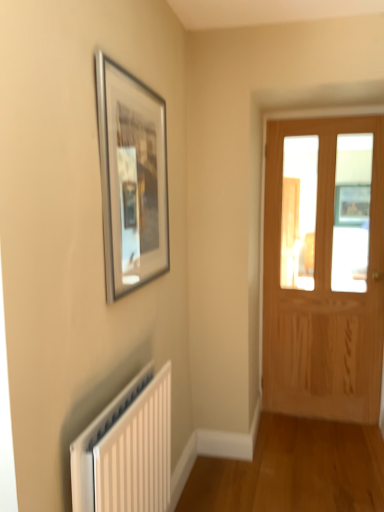
Question: Is white plastic radiator at lower left thinner than silver metallic picture frame at upper left?

Choices:
 (A) no
 (B) yes

Answer: (A)

Question: Is white plastic radiator at lower left behind silver metallic picture frame at upper left?

Choices:
 (A) no
 (B) yes

Answer: (A)

Question: Is white plastic radiator at lower left positioned with its back to silver metallic picture frame at upper left?

Choices:
 (A) no
 (B) yes

Answer: (A)

Question: Is white plastic radiator at lower left closer to the viewer compared to silver metallic picture frame at upper left?

Choices:
 (A) yes
 (B) no

Answer: (A)

Question: From the image's perspective, is white plastic radiator at lower left under silver metallic picture frame at upper left?

Choices:
 (A) yes
 (B) no

Answer: (A)

Question: Is white plastic radiator at lower left at the right side of silver metallic picture frame at upper left?

Choices:
 (A) no
 (B) yes

Answer: (A)

Question: Considering the relative sizes of white plastic radiator at lower left and light brown wooden door at right in the image provided, is white plastic radiator at lower left thinner than light brown wooden door at right?

Choices:
 (A) no
 (B) yes

Answer: (B)

Question: From the image's perspective, is white plastic radiator at lower left on top of light brown wooden door at right?

Choices:
 (A) yes
 (B) no

Answer: (B)

Question: Could light brown wooden door at right be considered to be inside white plastic radiator at lower left?

Choices:
 (A) yes
 (B) no

Answer: (B)

Question: From a real-world perspective, is white plastic radiator at lower left physically below light brown wooden door at right?

Choices:
 (A) yes
 (B) no

Answer: (A)

Question: From a real-world perspective, is white plastic radiator at lower left on light brown wooden door at right?

Choices:
 (A) no
 (B) yes

Answer: (A)

Question: Does white plastic radiator at lower left have a greater height compared to light brown wooden door at right?

Choices:
 (A) yes
 (B) no

Answer: (B)

Question: Considering the relative positions of silver metallic picture frame at upper left and white plastic radiator at lower left in the image provided, is silver metallic picture frame at upper left behind white plastic radiator at lower left?

Choices:
 (A) no
 (B) yes

Answer: (B)